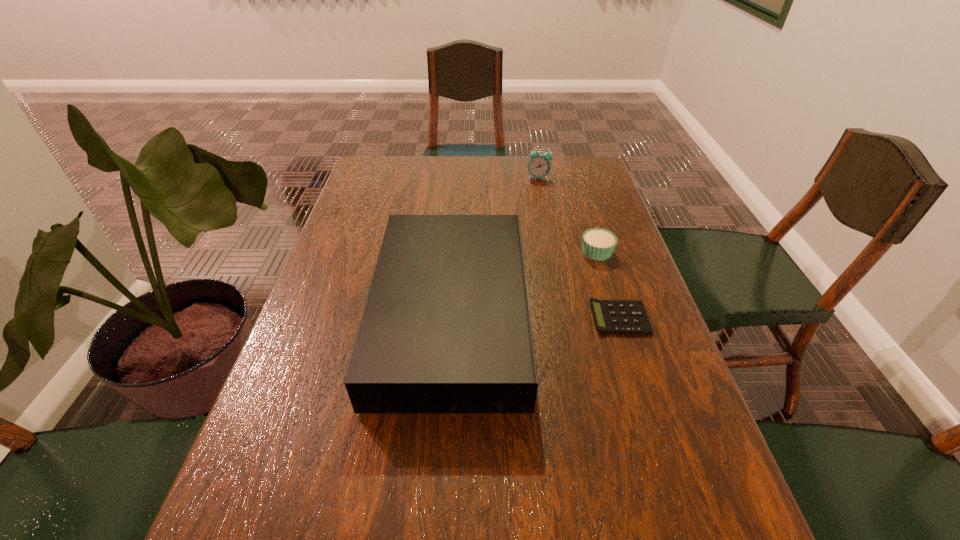
What are the coordinates of `cupcake present at the right edge` in the screenshot? It's located at (598, 244).

Locate an element on the screen. This screenshot has height=540, width=960. calculator that is at the right edge is located at coordinates (611, 316).

Locate an element on the screen. free space at the far edge of the desktop is located at coordinates (434, 171).

Locate an element on the screen. This screenshot has height=540, width=960. vacant space at the left edge of the desktop is located at coordinates (354, 226).

The image size is (960, 540). In the image, there is a desktop. What are the coordinates of `vacant space at the far right corner` in the screenshot? It's located at (561, 182).

Identify the location of vacant space that's between the farthest object and the cupcake. point(567,215).

Find the location of a particular element. The width and height of the screenshot is (960, 540). free area in between the third object from right to left and the shortest object is located at coordinates (579, 248).

This screenshot has width=960, height=540. I want to click on free space between the third object from right to left and the shortest object, so click(579, 248).

Where is `free space between the CD player and the shortest object`? free space between the CD player and the shortest object is located at coordinates (536, 317).

The height and width of the screenshot is (540, 960). Identify the location of empty location between the calculator and the cupcake. (609, 285).